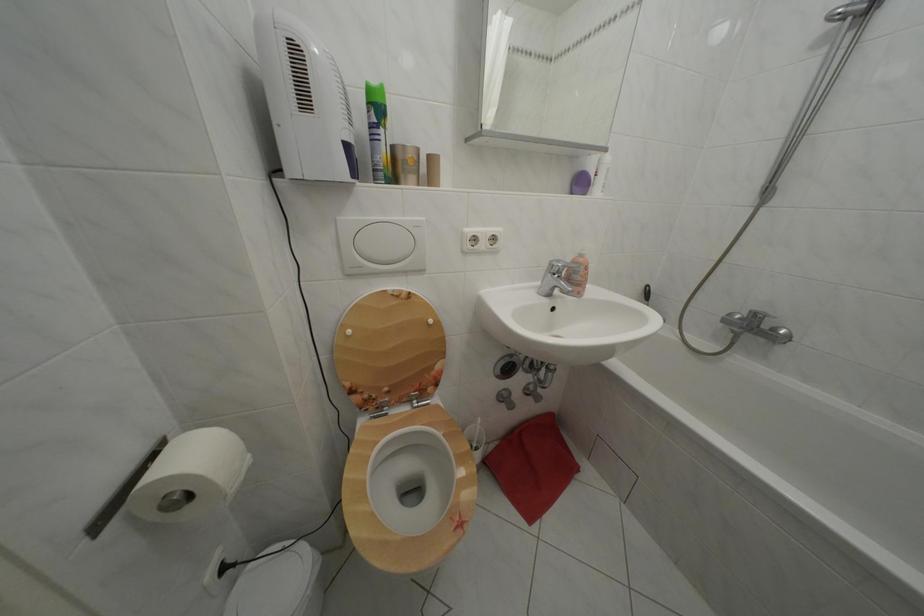
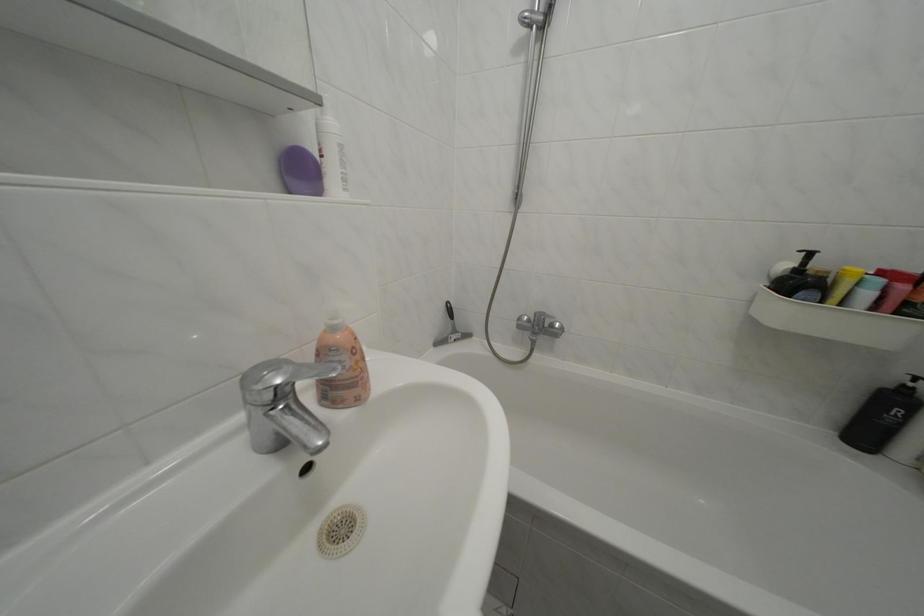
Where in the second image is the point corresponding to the point at 590,176 from the first image?

(301, 150)